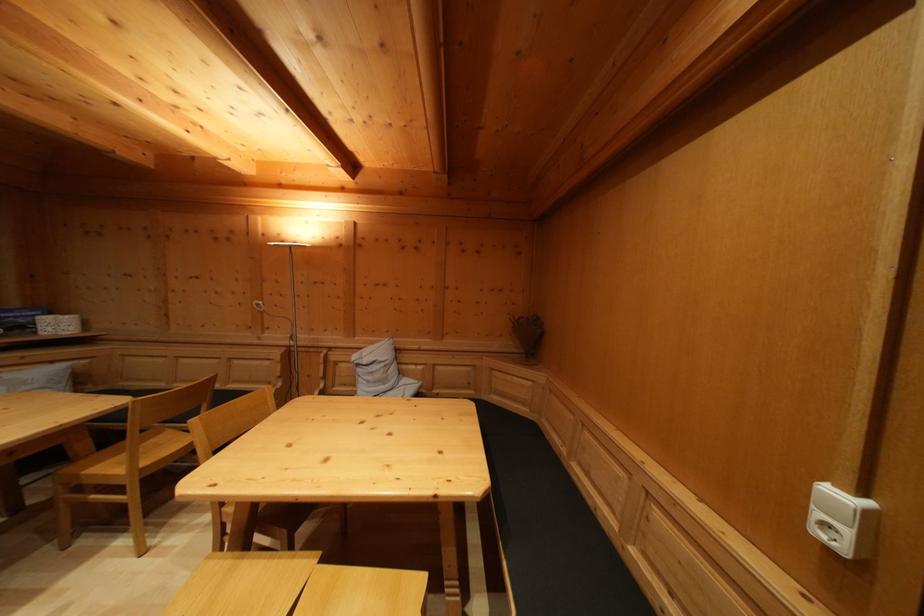
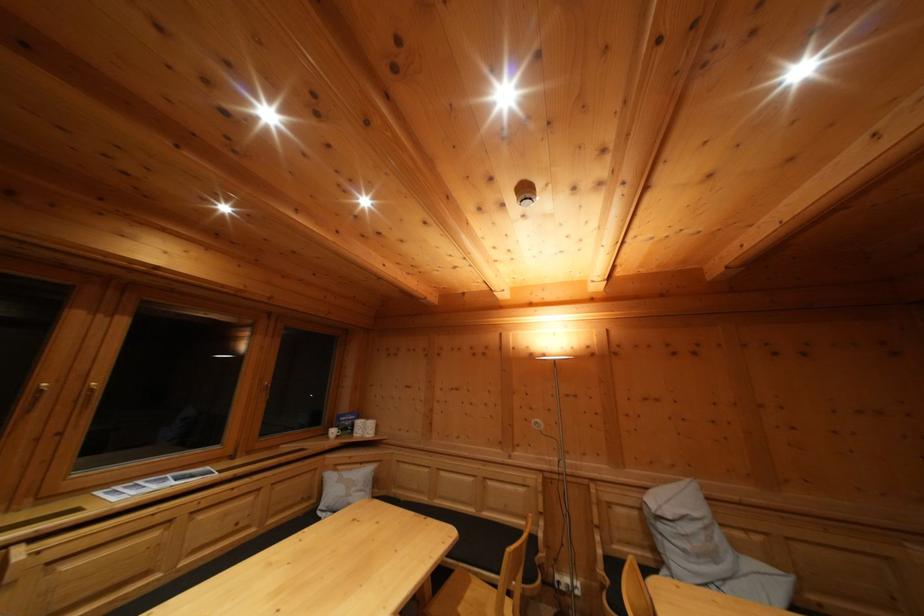
The point at (x=58, y=369) is marked in the first image. Where is the corresponding point in the second image?

(368, 469)